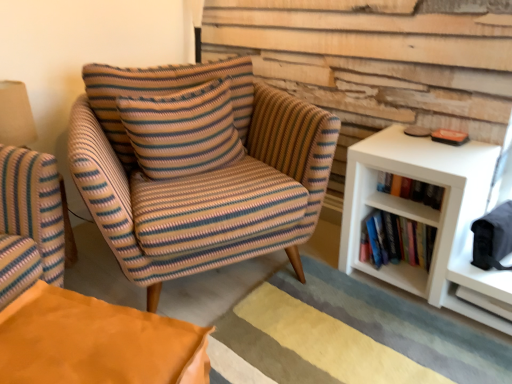
You are a GUI agent. You are given a task and a screenshot of the screen. Output one action in this format:
    pyautogui.click(x=<x>, y=<y>)
    Task: Click on the white matte bookshelf at right, the second shelf when ordered from right to left
    The height and width of the screenshot is (384, 512).
    Given the screenshot: What is the action you would take?
    pyautogui.click(x=368, y=213)

Image resolution: width=512 pixels, height=384 pixels. What do you see at coordinates (474, 311) in the screenshot?
I see `white matte shelf at right, which is counted as the first shelf, starting from the right` at bounding box center [474, 311].

Find the location of a particular element. The width and height of the screenshot is (512, 384). hardcover books at right is located at coordinates (411, 189).

Describe the element at coordinates (162, 94) in the screenshot. This screenshot has height=384, width=512. I see `knitted fabric pillow at center` at that location.

Locate an element on the screen. This screenshot has height=384, width=512. knitted fabric pillow at center is located at coordinates (162, 94).

Describe the element at coordinates (201, 176) in the screenshot. I see `striped fabric armchair at center` at that location.

The height and width of the screenshot is (384, 512). I want to click on white matte bookshelf at right, arranged as the 1th shelf when viewed from the left, so click(x=368, y=213).

Looking at this image, from a real-world perspective, is white matte shelf at right, which is counted as the first shelf, starting from the right, under striped fabric armchair at center?

Yes, from a real-world perspective, white matte shelf at right, which is counted as the first shelf, starting from the right, is beneath striped fabric armchair at center.

How many degrees apart are the facing directions of white matte shelf at right, which ranks as the second shelf in left-to-right order, and striped fabric armchair at center?

There is a 63.6-degree angle between the facing directions of white matte shelf at right, which ranks as the second shelf in left-to-right order, and striped fabric armchair at center.

Would you say white matte shelf at right, which ranks as the second shelf in left-to-right order, is inside or outside striped fabric armchair at center?

white matte shelf at right, which ranks as the second shelf in left-to-right order, lies outside striped fabric armchair at center.

Is white matte shelf at right, which ranks as the second shelf in left-to-right order, far away from striped fabric armchair at center?

Actually, white matte shelf at right, which ranks as the second shelf in left-to-right order, and striped fabric armchair at center are a little close together.

Does white matte bookshelf at right, arranged as the 1th shelf when viewed from the left, have a smaller size compared to white matte shelf at right, which is counted as the first shelf, starting from the right?

Incorrect, white matte bookshelf at right, arranged as the 1th shelf when viewed from the left, is not smaller in size than white matte shelf at right, which is counted as the first shelf, starting from the right.

Is white matte bookshelf at right, arranged as the 1th shelf when viewed from the left, looking in the opposite direction of white matte shelf at right, which ranks as the second shelf in left-to-right order?

That's not correct — white matte bookshelf at right, arranged as the 1th shelf when viewed from the left, is not looking away from white matte shelf at right, which ranks as the second shelf in left-to-right order.

From a real-world perspective, which object rests below the other?

From a 3D spatial view, white matte shelf at right, which is counted as the first shelf, starting from the right, is below.

From the image's perspective, is white matte bookshelf at right, arranged as the 1th shelf when viewed from the left, on white matte shelf at right, which is counted as the first shelf, starting from the right?

Yes, from the image's perspective, white matte bookshelf at right, arranged as the 1th shelf when viewed from the left, is on top of white matte shelf at right, which is counted as the first shelf, starting from the right.

Is point (166, 74) positioned after point (404, 279)?

Yes.

Would you consider knitted fabric pillow at center to be distant from white matte bookshelf at right, the second shelf when ordered from right to left?

No.

Does knitted fabric pillow at center appear on the right side of white matte bookshelf at right, the second shelf when ordered from right to left?

Incorrect, knitted fabric pillow at center is not on the right side of white matte bookshelf at right, the second shelf when ordered from right to left.

From a real-world perspective, is knitted fabric pillow at center below white matte bookshelf at right, the second shelf when ordered from right to left?

No, from a real-world perspective, knitted fabric pillow at center is not below white matte bookshelf at right, the second shelf when ordered from right to left.

Does point (158, 72) lie behind point (419, 193)?

Yes, point (158, 72) is farther from viewer.

In terms of size, does knitted fabric pillow at center appear bigger or smaller than hardcover books at right?

Considering their sizes, knitted fabric pillow at center takes up more space than hardcover books at right.

How different are the orientations of knitted fabric pillow at center and hardcover books at right in degrees?

knitted fabric pillow at center and hardcover books at right are facing 77.4 degrees away from each other.

In the image, is knitted fabric pillow at center on the left side or the right side of hardcover books at right?

From the image, it's evident that knitted fabric pillow at center is to the left of hardcover books at right.

Do you think white matte shelf at right, which is counted as the first shelf, starting from the right, is within hardcover books at right, or outside of it?

white matte shelf at right, which is counted as the first shelf, starting from the right, is not enclosed by hardcover books at right.

From a real-world perspective, is white matte shelf at right, which is counted as the first shelf, starting from the right, on top of hardcover books at right?

No, from a real-world perspective, white matte shelf at right, which is counted as the first shelf, starting from the right, is not on top of hardcover books at right.

How many degrees apart are the facing directions of white matte shelf at right, which ranks as the second shelf in left-to-right order, and hardcover books at right?

0.00119 degrees.

Which object is more forward, white matte shelf at right, which ranks as the second shelf in left-to-right order, or hardcover books at right?

Positioned in front is white matte shelf at right, which ranks as the second shelf in left-to-right order.

Which point is more distant from viewer, (234, 82) or (298, 130)?

The point (234, 82) is behind.

How far apart are knitted fabric pillow at center and striped fabric armchair at center?

6.74 inches.

From the picture: Is knitted fabric pillow at center not within striped fabric armchair at center?

Actually, knitted fabric pillow at center is at least partially inside striped fabric armchair at center.

From their relative heights in the image, would you say knitted fabric pillow at center is taller or shorter than striped fabric armchair at center?

In the image, knitted fabric pillow at center appears to be shorter than striped fabric armchair at center.

Between point (426, 184) and point (115, 129), which one is positioned behind?

Positioned behind is point (115, 129).

Is hardcover books at right in front of or behind knitted fabric pillow at center in the image?

Clearly, hardcover books at right is behind knitted fabric pillow at center.

From the image's perspective, which one is positioned lower, hardcover books at right or knitted fabric pillow at center?

hardcover books at right is shown below in the image.

Image resolution: width=512 pixels, height=384 pixels. I want to click on chair on the left of white matte shelf at right, which ranks as the second shelf in left-to-right order, so click(x=201, y=176).

In the image, there is a white matte bookshelf at right, arranged as the 1th shelf when viewed from the left. What are the coordinates of `shelf below it (from the image's perspective)` in the screenshot? It's located at (474, 311).

Which object lies further to the anchor point knitted fabric pillow at center, striped fabric armchair at center or hardcover books at right?

The object further to knitted fabric pillow at center is hardcover books at right.

Based on their spatial positions, is hardcover books at right or knitted fabric pillow at center closer to white matte shelf at right, which ranks as the second shelf in left-to-right order?

The object closer to white matte shelf at right, which ranks as the second shelf in left-to-right order, is hardcover books at right.

Based on their spatial positions, is striped fabric armchair at center or knitted fabric pillow at center further from white matte shelf at right, which is counted as the first shelf, starting from the right?

knitted fabric pillow at center is positioned further to the anchor white matte shelf at right, which is counted as the first shelf, starting from the right.

Based on their spatial positions, is white matte bookshelf at right, the second shelf when ordered from right to left, or hardcover books at right further from striped fabric armchair at center?

Based on the image, hardcover books at right appears to be further to striped fabric armchair at center.

Which object lies further to the anchor point hardcover books at right, white matte shelf at right, which ranks as the second shelf in left-to-right order, or knitted fabric pillow at center?

knitted fabric pillow at center lies further to hardcover books at right than the other object.

Which object lies nearer to the anchor point white matte shelf at right, which ranks as the second shelf in left-to-right order, striped fabric armchair at center or white matte bookshelf at right, the second shelf when ordered from right to left?

white matte bookshelf at right, the second shelf when ordered from right to left, is closer to white matte shelf at right, which ranks as the second shelf in left-to-right order.

From the image, which object appears to be nearer to white matte bookshelf at right, arranged as the 1th shelf when viewed from the left, knitted fabric pillow at center or hardcover books at right?

hardcover books at right is closer to white matte bookshelf at right, arranged as the 1th shelf when viewed from the left.

In the scene shown: Considering their positions, is hardcover books at right positioned closer to knitted fabric pillow at center than white matte bookshelf at right, the second shelf when ordered from right to left?

white matte bookshelf at right, the second shelf when ordered from right to left, is positioned closer to the anchor knitted fabric pillow at center.

Identify the location of book between striped fabric armchair at center and white matte shelf at right, which is counted as the first shelf, starting from the right, from left to right. The width and height of the screenshot is (512, 384). (411, 189).

Where is `shelf between hardcover books at right and white matte shelf at right, which is counted as the first shelf, starting from the right, in the vertical direction`? This screenshot has height=384, width=512. shelf between hardcover books at right and white matte shelf at right, which is counted as the first shelf, starting from the right, in the vertical direction is located at coordinates (368, 213).

This screenshot has height=384, width=512. Identify the location of book situated between knitted fabric pillow at center and white matte shelf at right, which ranks as the second shelf in left-to-right order, from left to right. (411, 189).

The height and width of the screenshot is (384, 512). In order to click on shelf between striped fabric armchair at center and white matte shelf at right, which is counted as the first shelf, starting from the right, from left to right in this screenshot , I will do `click(368, 213)`.